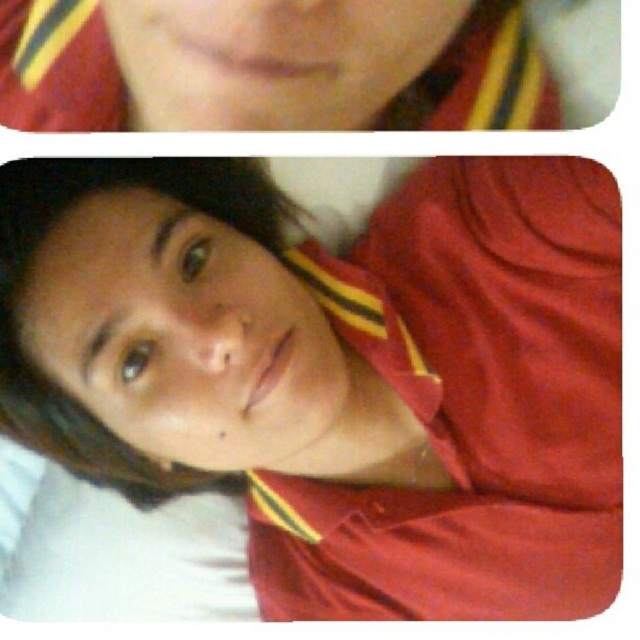
You are organizing a closet and need to hang two items labeled as the matte red shirt at center and the matte red shirt at upper center. According to the image, which one should be placed higher on the hanger to match their positions?

The matte red shirt at upper center should be placed higher on the hanger since it was positioned above the matte red shirt at center in the image.

You are taking a selfie and want to know which of the two points, point (x=253, y=180) or point (x=35, y=61), is closer to the camera lens. Based on the image, which point is nearer?

Point (x=253, y=180) is further to the viewer than point (x=35, y=61), so point (x=35, y=61) is closer to the camera lens.

From the picture: You are holding a camera and want to take a selfie with the matte red shirt at center. If your arm can extend 22 inches, can you take the selfie without using a selfie stick?

The distance between the matte red shirt at center and the camera is 23.41 inches. Since your arm can only extend 22 inches, you cannot reach the required distance without a selfie stick.